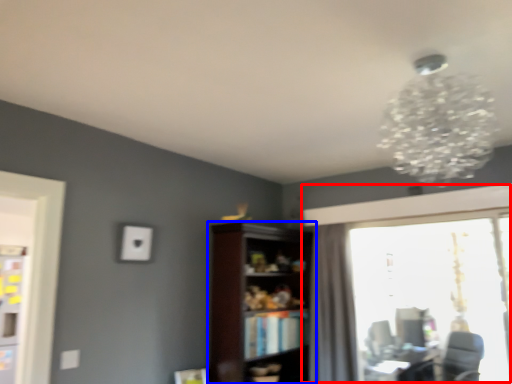
Question: Which object is closer to the camera taking this photo, window (highlighted by a red box) or shelf (highlighted by a blue box)?

Choices:
 (A) window
 (B) shelf

Answer: (B)